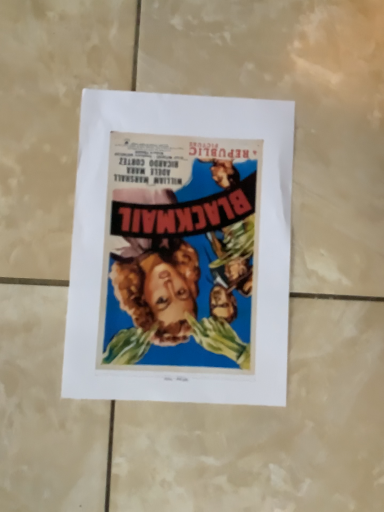
Locate an element on the screen. Image resolution: width=384 pixels, height=512 pixels. free space above matte paper poster at center (from a real-world perspective) is located at coordinates (189, 241).